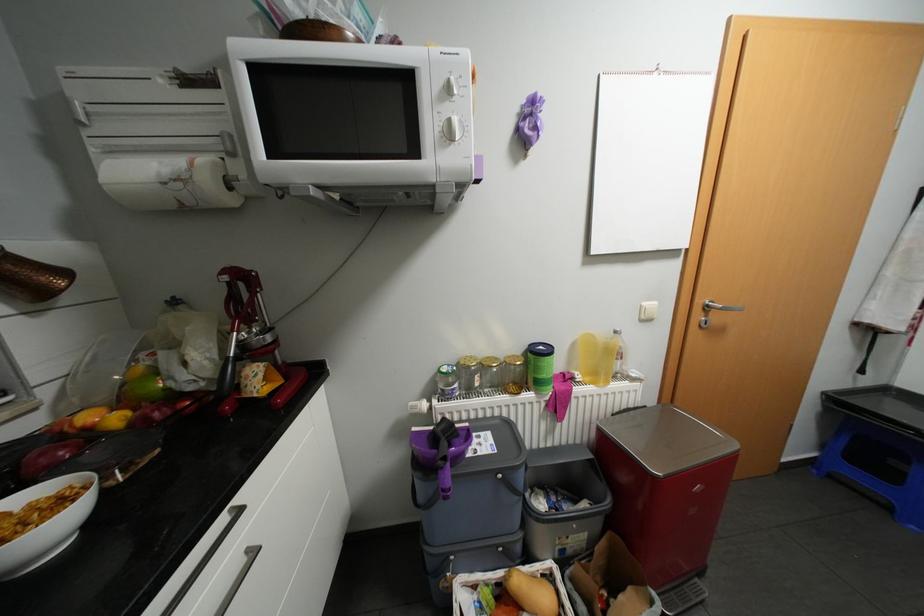
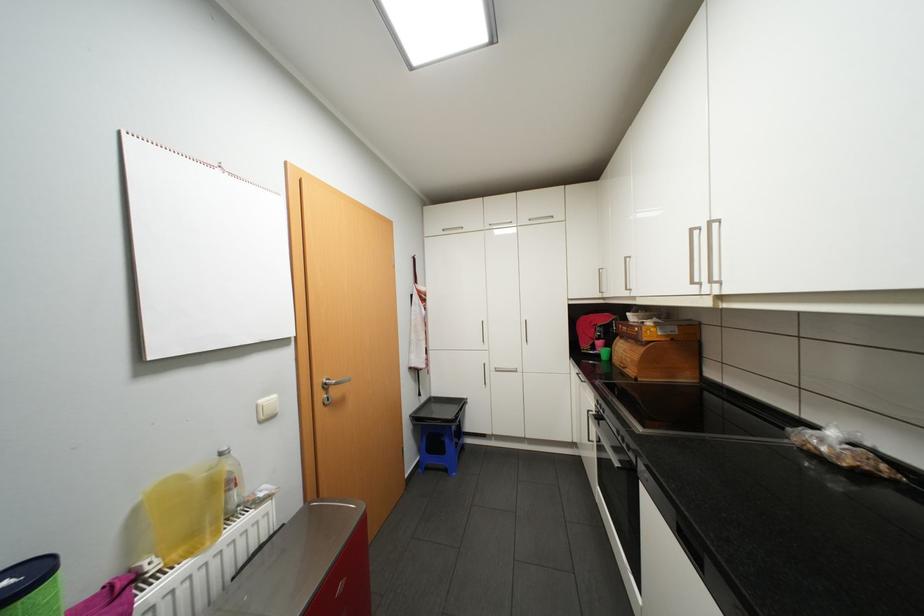
Question: The camera is either moving clockwise (left) or counter-clockwise (right) around the object. The first image is from the beginning of the video and the second image is from the end. Is the camera moving left or right when shooting the video?

Choices:
 (A) Left
 (B) Right

Answer: (A)